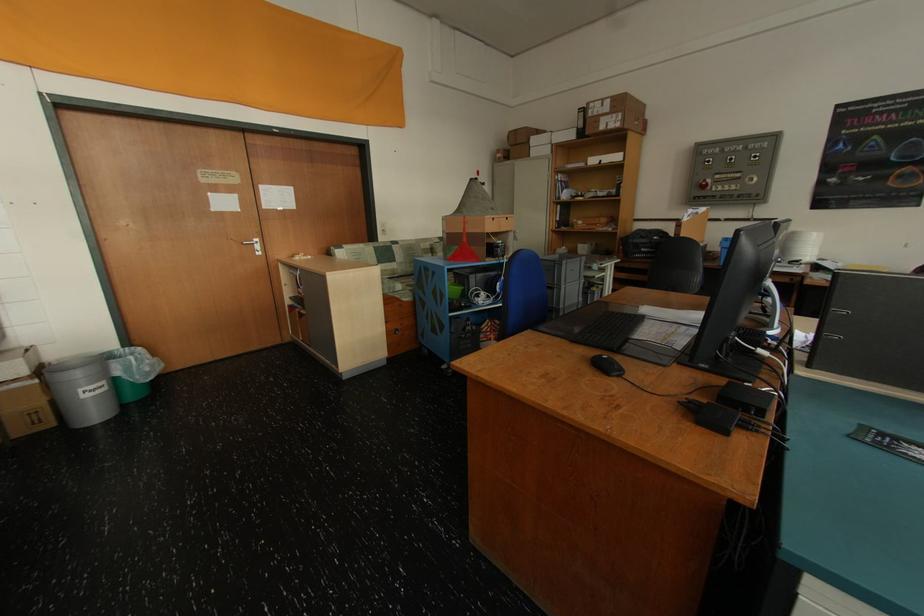
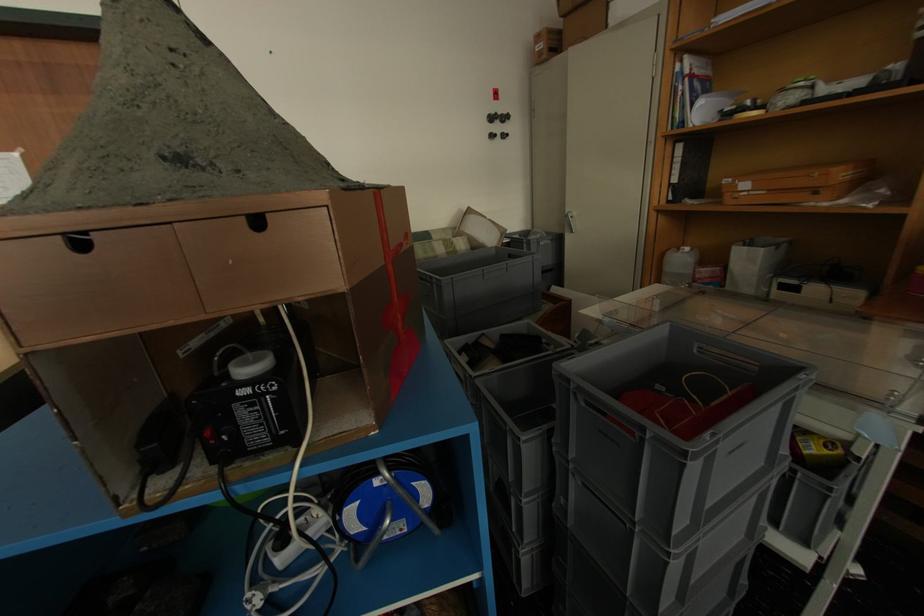
Question: In a continuous first-person perspective shot, in which direction is the camera moving?

Choices:
 (A) Left
 (B) Right
 (C) Forward
 (D) Backward

Answer: (C)